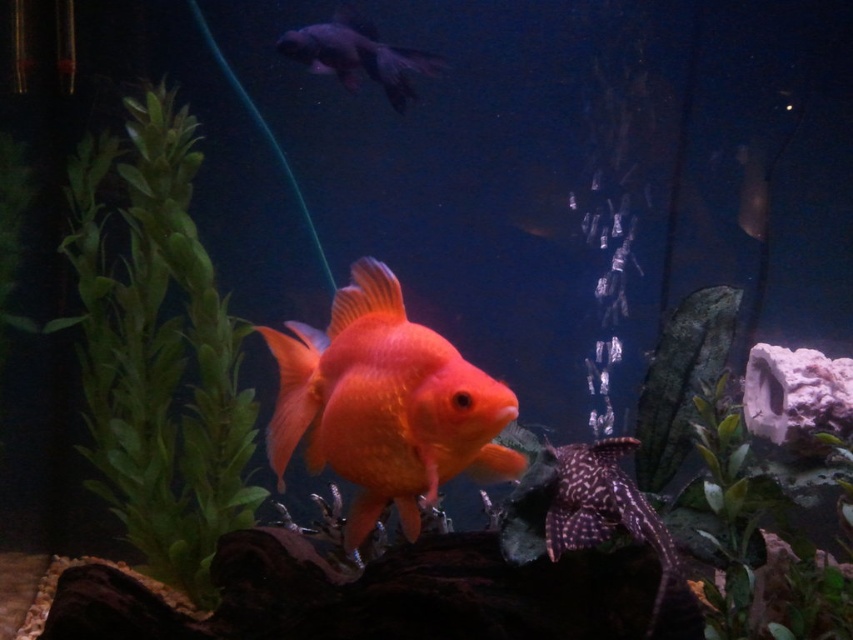
Which is more to the right, shiny orange fish at center or green matte plant at lower right?

Positioned to the right is green matte plant at lower right.

Can you confirm if shiny orange fish at center is wider than green matte plant at lower right?

Correct, the width of shiny orange fish at center exceeds that of green matte plant at lower right.

Is point (413, 477) closer to viewer compared to point (695, 401)?

Yes, it is in front of point (695, 401).

Where is `shiny orange fish at center`? This screenshot has width=853, height=640. shiny orange fish at center is located at coordinates (386, 404).

Can you confirm if green leafy plant at left is positioned to the right of green matte plant at lower right?

In fact, green leafy plant at left is to the left of green matte plant at lower right.

Can you confirm if green leafy plant at left is bigger than green matte plant at lower right?

Indeed, green leafy plant at left has a larger size compared to green matte plant at lower right.

In order to click on green leafy plant at left in this screenshot , I will do `click(160, 356)`.

This screenshot has height=640, width=853. I want to click on green leafy plant at left, so click(160, 356).

Which is below, shiny black and white spotted fish at lower center or shiny black fish at upper center?

shiny black and white spotted fish at lower center is lower down.

Can you confirm if shiny black and white spotted fish at lower center is taller than shiny black fish at upper center?

Yes.

Which is behind, point (643, 636) or point (292, 36)?

The point (292, 36) is behind.

Where is `shiny black and white spotted fish at lower center`? shiny black and white spotted fish at lower center is located at coordinates (604, 508).